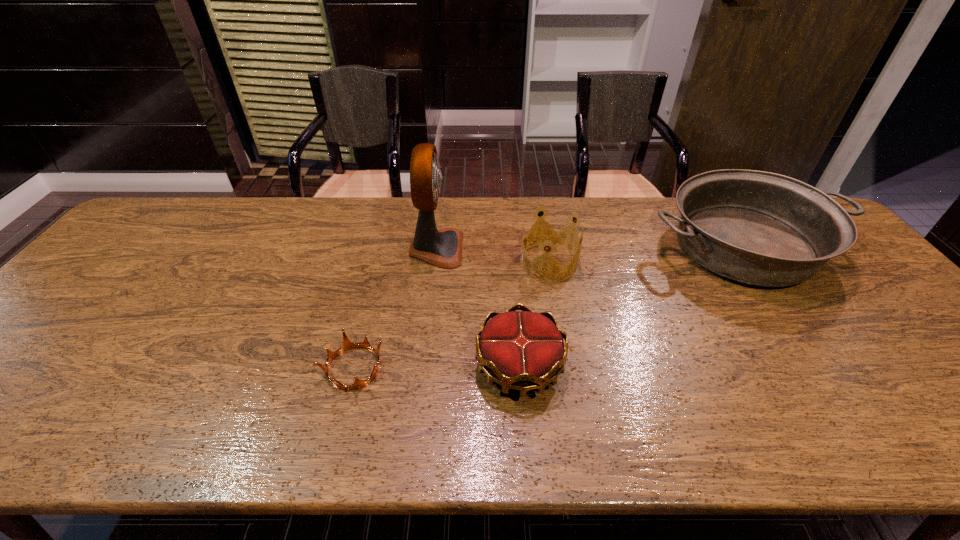
Locate which object is the second closest to the fourth tallest object. Please provide its 2D coordinates. Your answer should be formatted as a tuple, i.e. [(x, y)], where the tuple contains the x and y coordinates of a point satisfying the conditions above.

[(347, 344)]

You are a GUI agent. You are given a task and a screenshot of the screen. Output one action in this format:
    pyautogui.click(x=<x>, y=<y>)
    Task: Click on the crown that is the closest to the fourth tallest object
    The height and width of the screenshot is (540, 960).
    Given the screenshot: What is the action you would take?
    pyautogui.click(x=552, y=236)

The width and height of the screenshot is (960, 540). Find the location of `crown identified as the closest to the rightmost object`. crown identified as the closest to the rightmost object is located at coordinates (552, 236).

The height and width of the screenshot is (540, 960). I want to click on blank space that satisfies the following two spatial constraints: 1. on the front-facing side of the tallest crown; 2. on the left side of the second object from left to right, so click(435, 262).

The height and width of the screenshot is (540, 960). Identify the location of vacant space that satisfies the following two spatial constraints: 1. on the front side of the pan; 2. on the front-facing side of the tallest object. (744, 248).

At what (x,y) coordinates should I click in order to perform the action: click on free space that satisfies the following two spatial constraints: 1. on the front-facing side of the fourth object from right to left; 2. on the right side of the fourth tallest object. Please return your answer as a coordinate pair (x, y). Image resolution: width=960 pixels, height=540 pixels. Looking at the image, I should click on (422, 367).